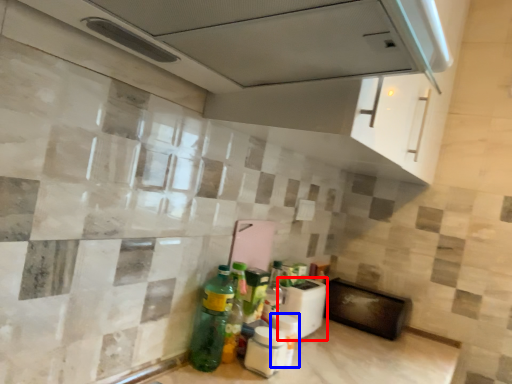
Question: Which object appears closest to the camera in this image, appliance (highlighted by a red box) or bottle (highlighted by a blue box)?

Choices:
 (A) appliance
 (B) bottle

Answer: (B)